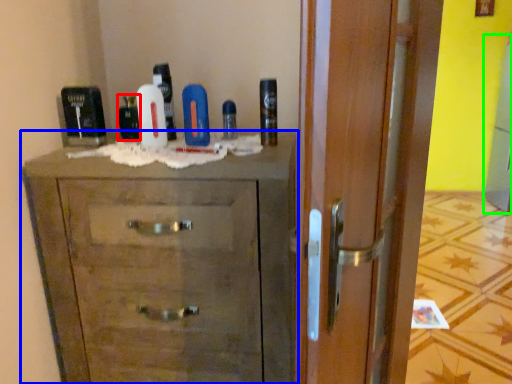
Question: Which object is the farthest from mouthwash (highlighted by a red box)? Choose among these: chest of drawers (highlighted by a blue box) or screen door (highlighted by a green box).

Choices:
 (A) chest of drawers
 (B) screen door

Answer: (B)